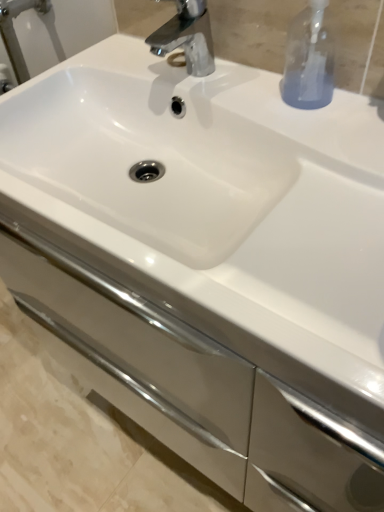
Find the location of `free space in front of transparent glass soap dispenser at upper right`. free space in front of transparent glass soap dispenser at upper right is located at coordinates (326, 134).